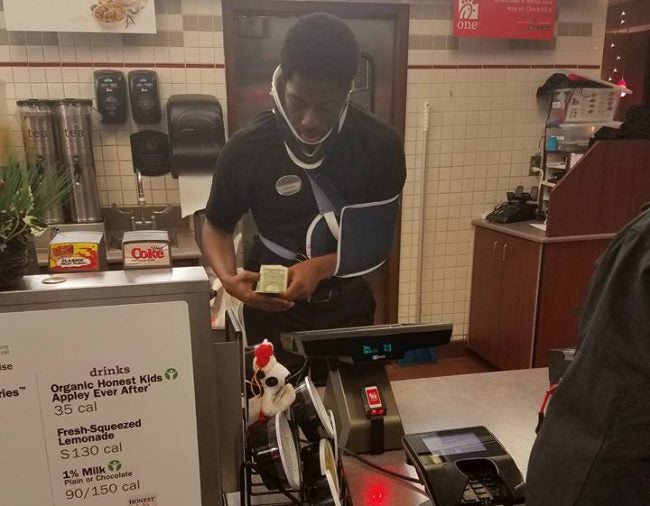
Point to any where you would get paper towels in the image. Your answer should be formatted as a list of tuples, i.e. [(x1, y1), (x2, y2), ...], where each tuple contains the x and y coordinates of a point satisfying the conditions above.

[(188, 201)]